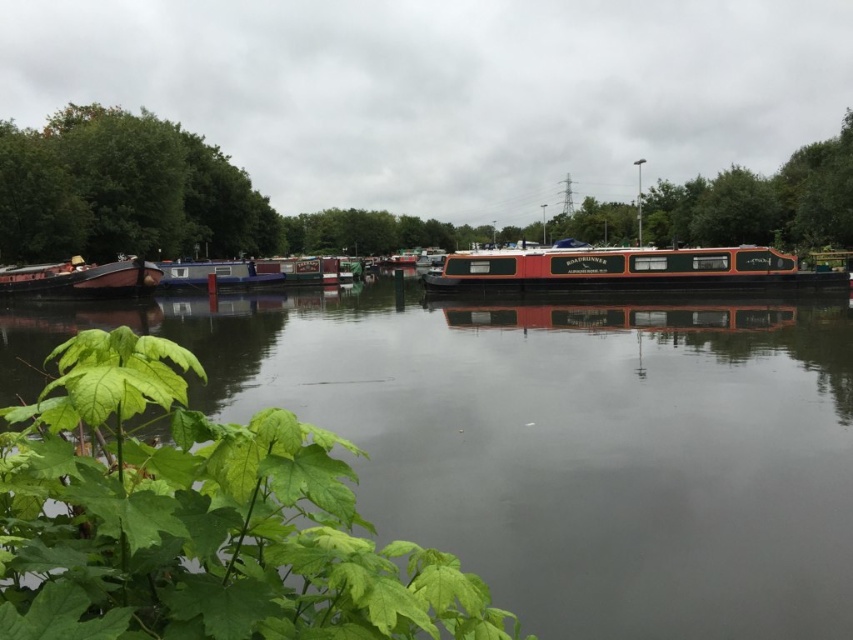
You are standing at the riverside and want to determine the relative positions of two points marked in the scene. Which point is closer to you, point 1 at coordinates point (154, 234) or point 2 at coordinates point (68, 272)?

Point 1 at coordinates point (154, 234) is closer to you because it is further to the viewer than point 2 at coordinates point (68, 272).

You are standing on the riverside and want to know if the smooth water at center is wider than the wooden boat at left. Can you tell me?

The smooth water at center is shorter than wooden boat at left, so it is not wider than the wooden boat at left.